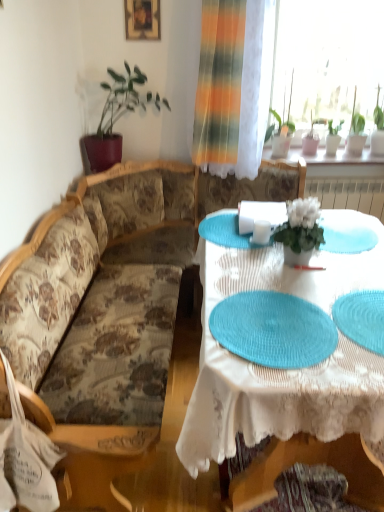
Question: From the image's perspective, relative to teal woven placemat at center, is green matte plant at upper right, arranged as the first houseplant when viewed from the back, above or below?

Choices:
 (A) below
 (B) above

Answer: (B)

Question: Considering the positions of point (332, 122) and point (243, 302), is point (332, 122) closer or farther from the camera than point (243, 302)?

Choices:
 (A) farther
 (B) closer

Answer: (A)

Question: Based on their relative distances, which object is farther from the green matte plant at upper right, the fourth houseplant viewed from the left?

Choices:
 (A) floral fabric couch at left
 (B) wooden picture frame at upper center
 (C) green leafy plant at upper left, placed as the 5th houseplant when sorted from right to left
 (D) green leafy plant at upper right, the third houseplant viewed from the back
 (E) white matte flower pot at center, placed as the 2th houseplant when sorted from left to right

Answer: (A)

Question: Based on their relative distances, which object is farther from the teal woven placemat at center?

Choices:
 (A) green leafy plant at upper right, the second houseplant when ordered from back to front
 (B) green leafy plant at upper right, which ranks as the 3th houseplant in front-to-back order
 (C) wooden picture frame at upper center
 (D) green leafy plant at upper left, placed as the 5th houseplant when sorted from right to left
 (E) floral fabric couch at left

Answer: (C)